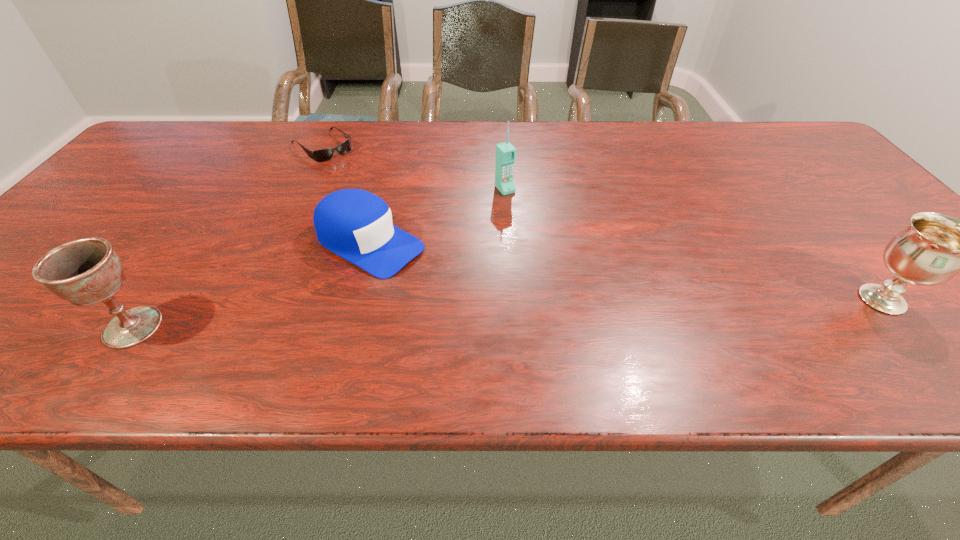
Locate an element on the screen. blank space located 0.300m on the keypad of the fourth object from left to right is located at coordinates (575, 269).

Identify the location of free space located 0.120m on the keypad of the fourth object from left to right. (533, 222).

Locate an element on the screen. blank space located 0.360m on the keypad of the fourth object from left to right is located at coordinates (590, 288).

Find the location of a particular element. This screenshot has height=540, width=960. vacant space located 0.090m on the front-facing side of the farthest object is located at coordinates (353, 172).

Identify the location of vacant space situated on the front-facing side of the farthest object. This screenshot has width=960, height=540. (379, 195).

Image resolution: width=960 pixels, height=540 pixels. In order to click on free location located 0.130m on the front-facing side of the farthest object in this screenshot , I will do `click(360, 179)`.

Where is `vacant region located 0.150m on the front-facing side of the third farthest object`? vacant region located 0.150m on the front-facing side of the third farthest object is located at coordinates (467, 294).

This screenshot has width=960, height=540. I want to click on vacant space located on the front-facing side of the third farthest object, so click(474, 298).

Image resolution: width=960 pixels, height=540 pixels. I want to click on vacant space located 0.240m on the front-facing side of the third farthest object, so click(503, 313).

Find the location of `object present at the far edge`. object present at the far edge is located at coordinates (322, 155).